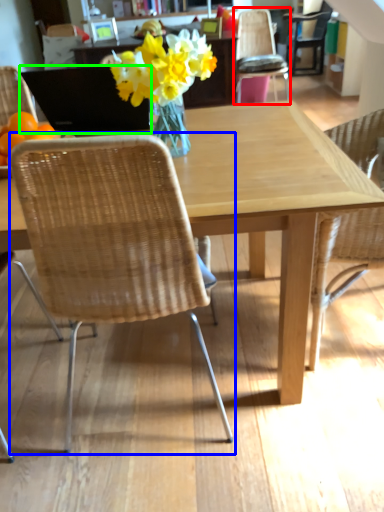
Question: Which object is positioned farthest from chair (highlighted by a red box)? Select from chair (highlighted by a blue box) and laptop (highlighted by a green box).

Choices:
 (A) chair
 (B) laptop

Answer: (A)